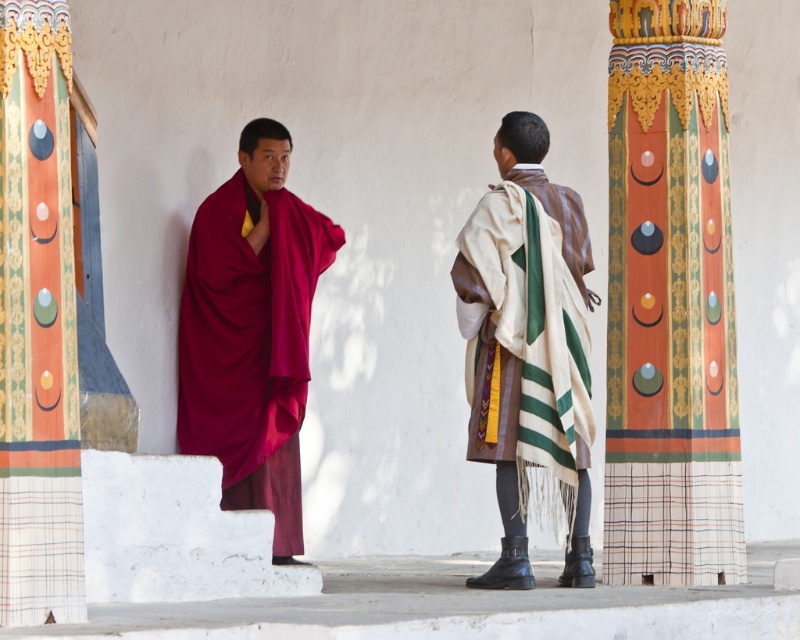
Is painted wood column at right above maroon silk robe at left?

No, painted wood column at right is not above maroon silk robe at left.

Is painted wood column at right taller than maroon silk robe at left?

Indeed, painted wood column at right has a greater height compared to maroon silk robe at left.

The image size is (800, 640). I want to click on painted wood column at right, so click(x=670, y=301).

Describe the element at coordinates (250, 346) in the screenshot. This screenshot has width=800, height=640. I see `maroon silk robe at left` at that location.

Who is lower down, maroon silk robe at left or beige woven shawl at center?

beige woven shawl at center is below.

Is point (268, 289) closer to camera compared to point (564, 195)?

No, it is behind (564, 195).

Locate an element on the screen. The height and width of the screenshot is (640, 800). maroon silk robe at left is located at coordinates (250, 346).

How distant is painted wood column at right from beige woven shawl at center?

They are 6.04 meters apart.

Can you confirm if painted wood column at right is thinner than beige woven shawl at center?

Incorrect, painted wood column at right's width is not less than beige woven shawl at center's.

You are a GUI agent. You are given a task and a screenshot of the screen. Output one action in this format:
    pyautogui.click(x=<x>, y=<y>)
    Task: Click on the painted wood column at right
    Image resolution: width=800 pixels, height=640 pixels.
    Given the screenshot: What is the action you would take?
    pyautogui.click(x=670, y=301)

Locate an element on the screen. The height and width of the screenshot is (640, 800). painted wood column at right is located at coordinates (670, 301).